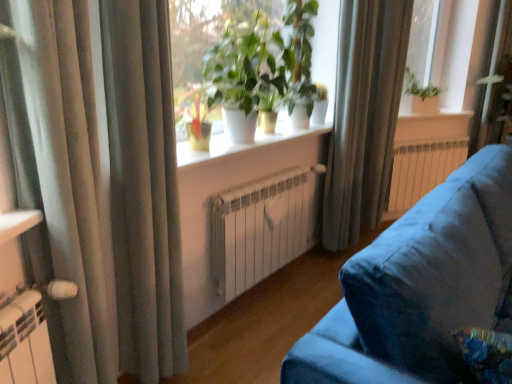
The image size is (512, 384). I want to click on vacant area on top of white metallic radiator at center, acting as the second radiator starting from the front (from a real-world perspective), so click(x=431, y=138).